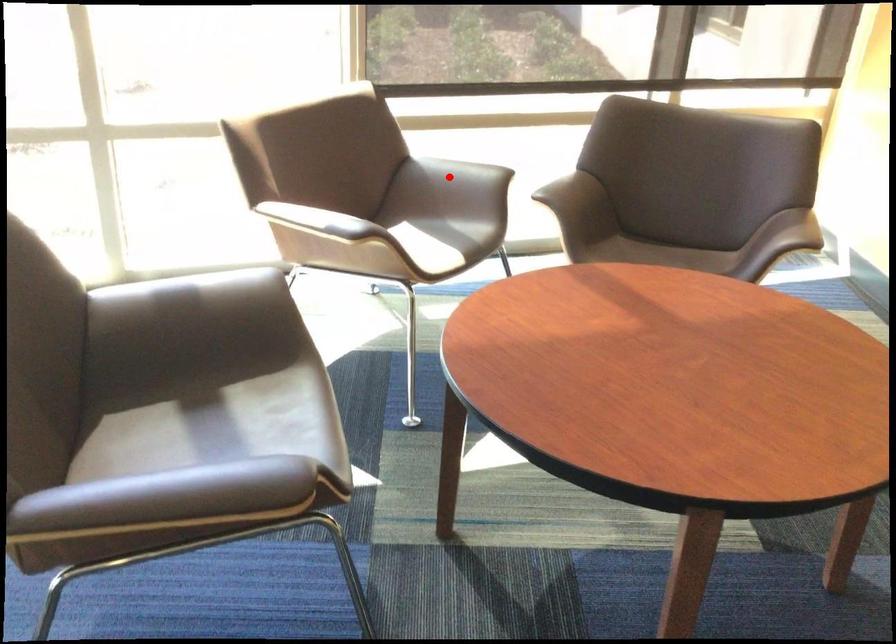
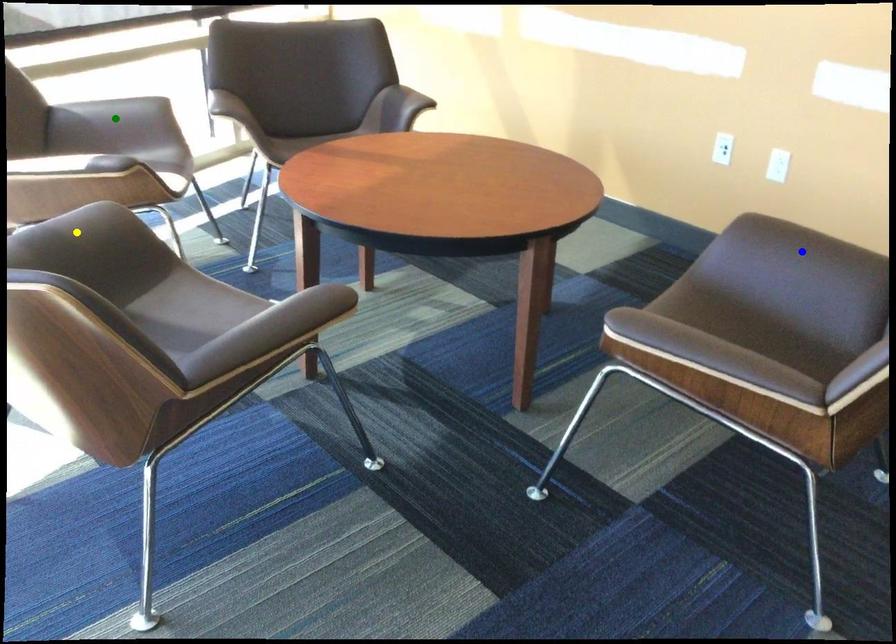
Question: I am providing you with two images of the same scene from different viewpoints. A red point is marked on the first image. You are given multiple points on the second image. Can you choose the point in image 2 that corresponds to the point in image 1?

Choices:
 (A) green point
 (B) blue point
 (C) yellow point

Answer: (A)